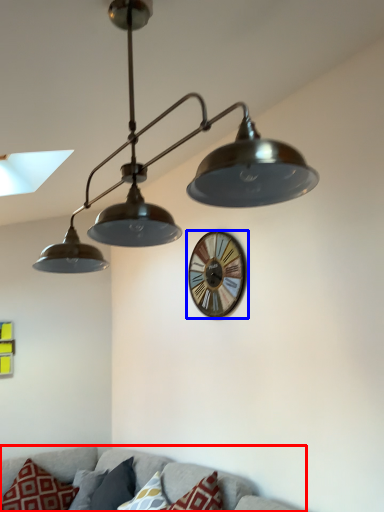
Question: Which object appears farthest to the camera in this image, couch (highlighted by a red box) or wall clock (highlighted by a blue box)?

Choices:
 (A) couch
 (B) wall clock

Answer: (B)